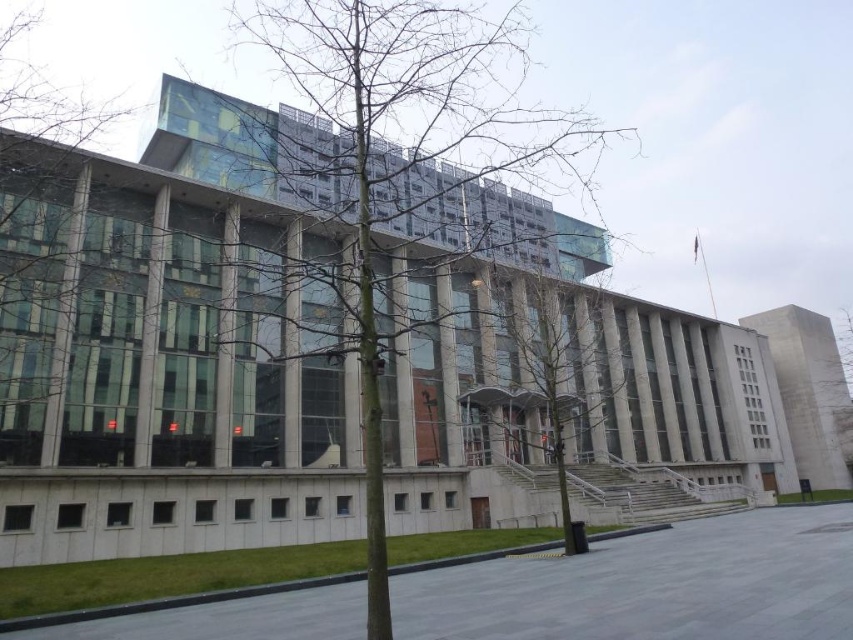
You are a photographer planning to capture the building and its surroundings. You want to ensure both the bare branches at center and the green leafless tree at left are clearly visible in your shot. Considering their sizes, which tree should you position closer to the camera to maintain their visibility without cropping?

The bare branches at center is larger in size than the green leafless tree at left, so positioning the green leafless tree at left closer to the camera would help maintain visibility as it is smaller and needs to be nearer to appear balanced in the frame.

You are a landscape architect designing a pathway between the green leafless tree at left and the green leafless tree at right. Which tree requires a wider space allocation due to its size?

The green leafless tree at right requires a wider space allocation because it has a greater width compared to the green leafless tree at left.